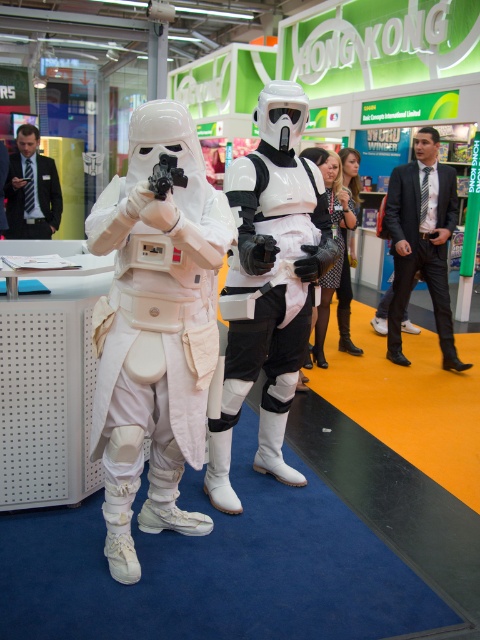
You are at the Hong Kong booth and need to hand out a flyer to both the white matte stormtrooper at center and the dark blue suit at left. Which one should you approach first based on their positions?

The white matte stormtrooper at center is closer to the viewer than the dark blue suit at left, so you should approach the white matte stormtrooper at center first.

Looking at this image, you are at the Hong Kong booth and need to find the registration desk. You see a white matte stormtrooper at center and a dark blue suit at left. Which one is closer to the ground?

The white matte stormtrooper at center is below dark blue suit at left, so it is closer to the ground.